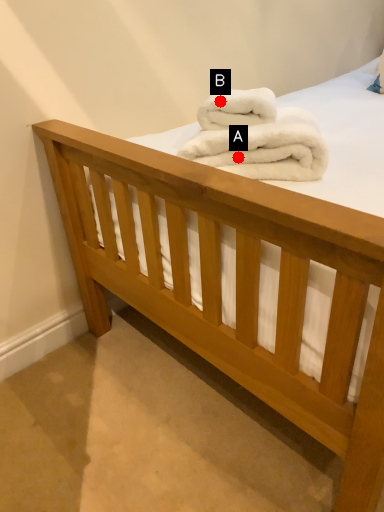
Question: Two points are circled on the image, labeled by A and B beside each circle. Which point is farther from the camera taking this photo?

Choices:
 (A) A is further
 (B) B is further

Answer: (B)